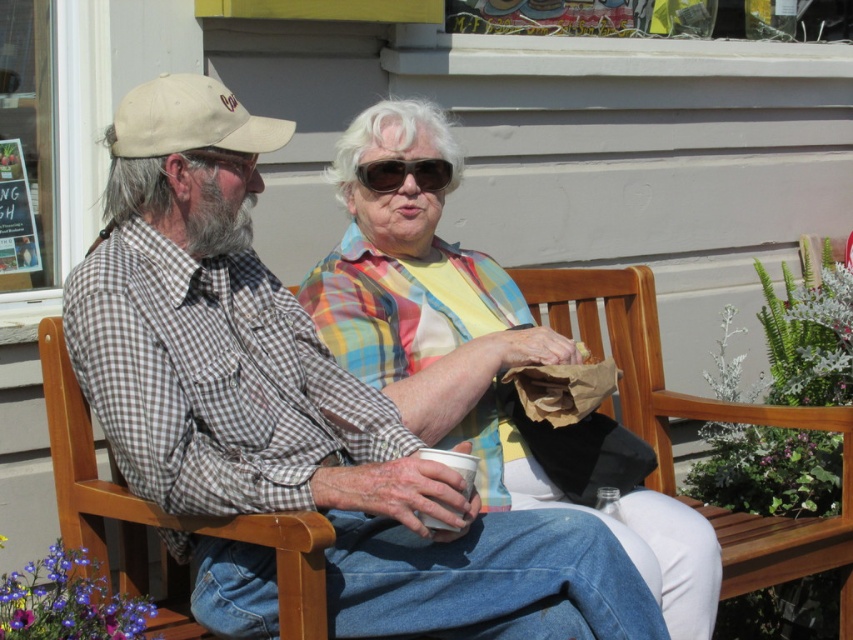
You are standing in front of the wooden bench where the older man and woman are sitting. There are two points marked on the bench. One is at coordinate point (196, 113) and the other is at point (376, 182). Which point is closer to you?

Point (196, 113) is closer to the viewer than point (376, 182).